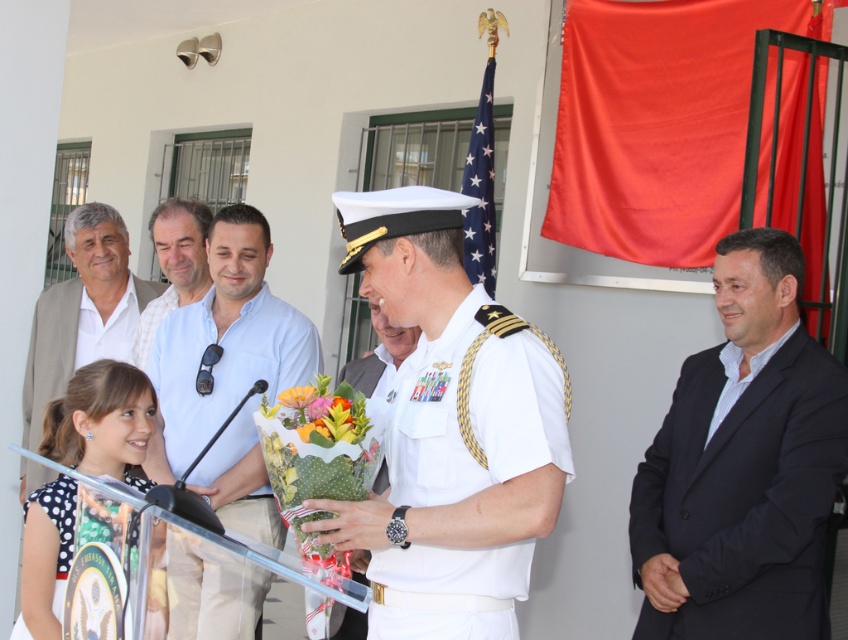
Is polka dot fabric dress at lower left below white matte uniform at center?

No.

Can you confirm if polka dot fabric dress at lower left is shorter than white matte uniform at center?

In fact, polka dot fabric dress at lower left may be taller than white matte uniform at center.

Between point (456, 595) and point (559, 438), which one is positioned behind?

The point (456, 595) is behind.

In order to click on polka dot fabric dress at lower left in this screenshot , I will do click(480, 504).

Does glossy floral bouquet at center come behind yellow matte flower at center?

No, glossy floral bouquet at center is closer to the viewer.

Is glossy floral bouquet at center to the left of yellow matte flower at center from the viewer's perspective?

Incorrect, glossy floral bouquet at center is not on the left side of yellow matte flower at center.

Which is in front, point (344, 432) or point (293, 388)?

Point (344, 432) is in front.

Identify the location of glossy floral bouquet at center. The image size is (848, 640). (321, 412).

Between polka dot fabric dress at lower left and navy blue suit at right, which one is positioned higher?

Positioned higher is polka dot fabric dress at lower left.

Describe the element at coordinates (480, 504) in the screenshot. The height and width of the screenshot is (640, 848). I see `polka dot fabric dress at lower left` at that location.

Who is more forward, (471, 577) or (795, 451)?

Positioned in front is point (471, 577).

The image size is (848, 640). Find the location of `polka dot fabric dress at lower left`. polka dot fabric dress at lower left is located at coordinates (480, 504).